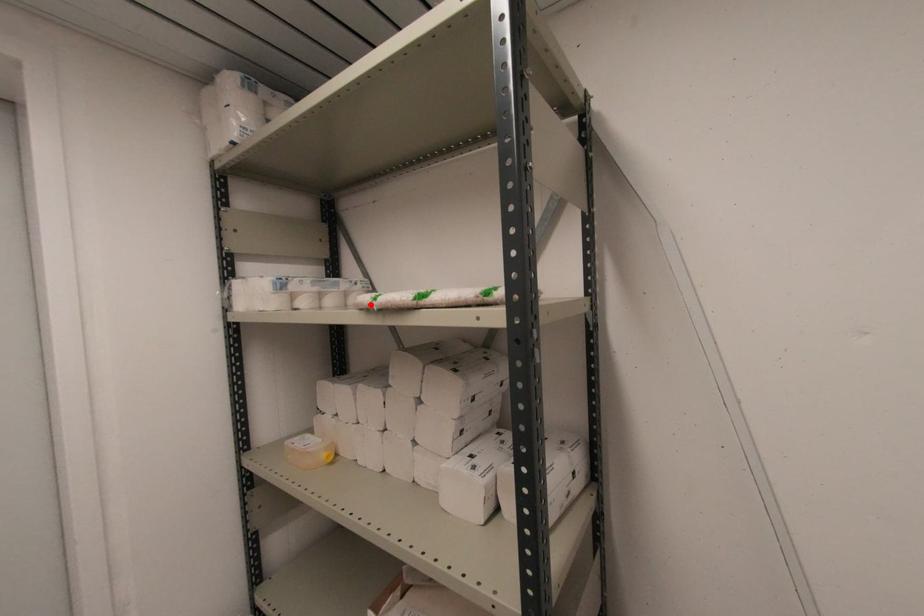
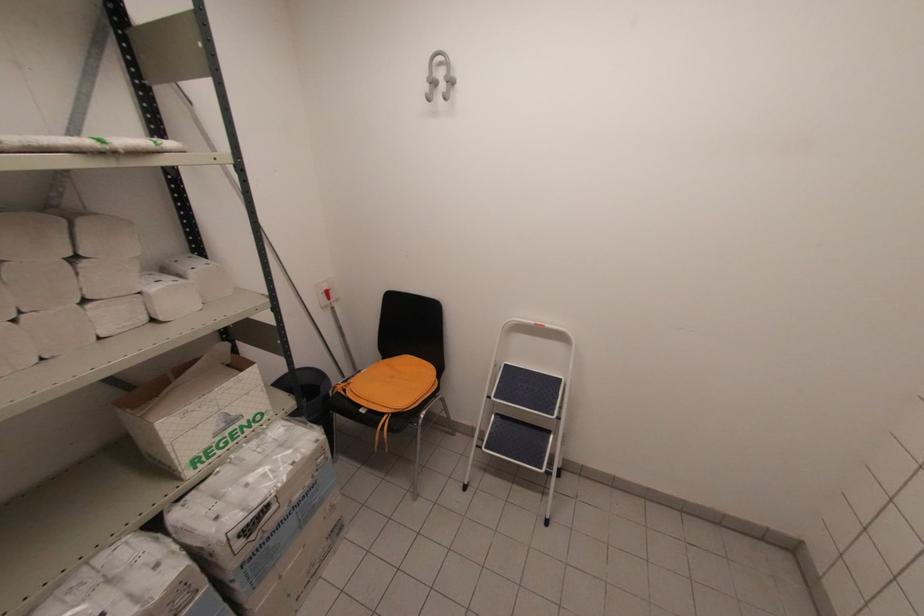
In the second image, find the point that corresponds to the highlighted location in the first image.

(107, 148)